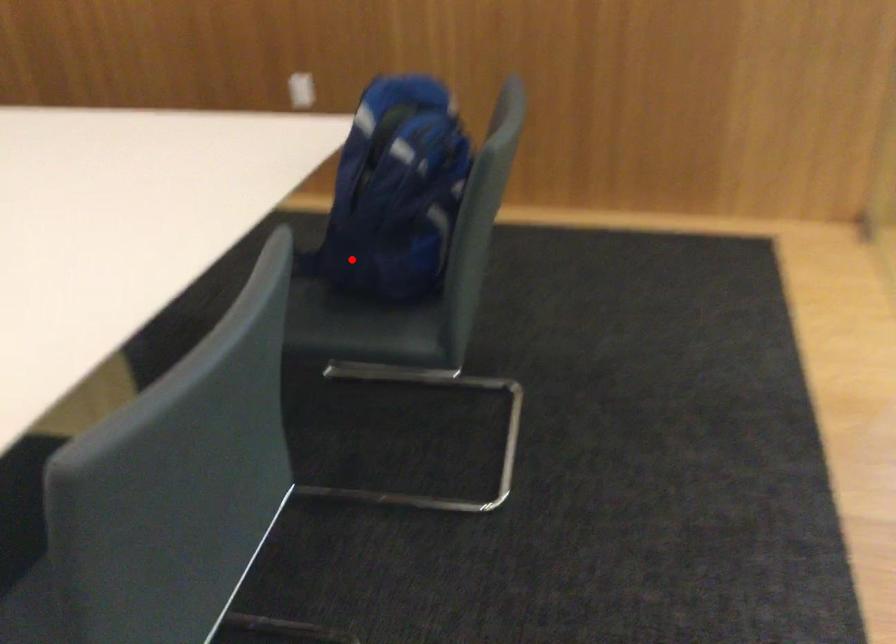
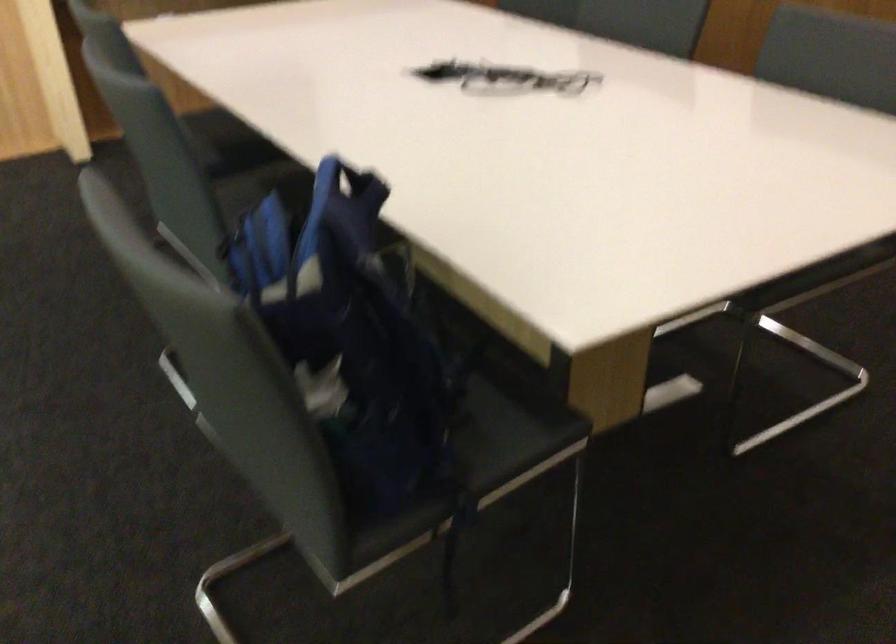
Question: I am providing you with two images of the same scene from different viewpoints. Image1 has a red point marked. In image2, the corresponding 3D location appears at what relative position? Reply with the corresponding letter.

Choices:
 (A) Closer
 (B) Farther

Answer: (A)